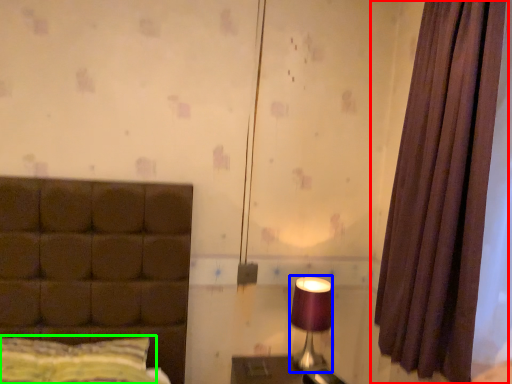
Question: Which object is the closest to the curtain (highlighted by a red box)? Choose among these: table lamp (highlighted by a blue box) or pillow (highlighted by a green box).

Choices:
 (A) table lamp
 (B) pillow

Answer: (A)